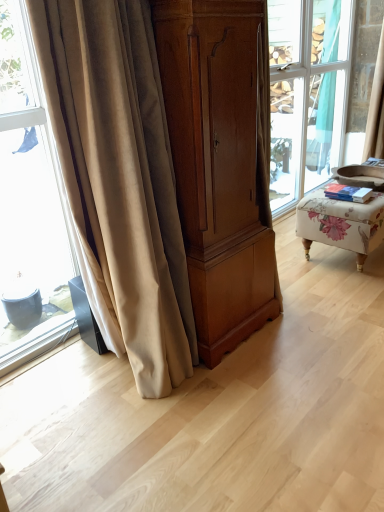
Question: Should I look upward or downward to see floral fabric ottoman at right?

Choices:
 (A) down
 (B) up

Answer: (B)

Question: Is matte wood cabinet at center not inside beige fabric curtain at upper right, the first curtain in the back-to-front sequence?

Choices:
 (A) no
 (B) yes

Answer: (B)

Question: Considering the relative sizes of matte wood cabinet at center and beige fabric curtain at upper right, positioned as the second curtain in left-to-right order, in the image provided, is matte wood cabinet at center bigger than beige fabric curtain at upper right, positioned as the second curtain in left-to-right order,?

Choices:
 (A) no
 (B) yes

Answer: (B)

Question: Is matte wood cabinet at center positioned before beige fabric curtain at upper right, the second curtain positioned from the front?

Choices:
 (A) no
 (B) yes

Answer: (B)

Question: From a real-world perspective, is matte wood cabinet at center located beneath beige fabric curtain at upper right, the first curtain when ordered from right to left?

Choices:
 (A) no
 (B) yes

Answer: (B)

Question: From the image's perspective, is matte wood cabinet at center under beige fabric curtain at upper right, the second curtain ordered from the bottom?

Choices:
 (A) yes
 (B) no

Answer: (A)

Question: Is matte wood cabinet at center oriented away from beige fabric curtain at upper right, the second curtain ordered from the bottom?

Choices:
 (A) no
 (B) yes

Answer: (A)

Question: From the image's perspective, would you say floral fabric ottoman at right is shown under beige velvet curtain at left, which is the 2th curtain in top-to-bottom order?

Choices:
 (A) yes
 (B) no

Answer: (B)

Question: Would you say floral fabric ottoman at right is outside beige velvet curtain at left, which ranks as the 1th curtain in bottom-to-top order?

Choices:
 (A) no
 (B) yes

Answer: (B)

Question: Can you confirm if floral fabric ottoman at right is positioned to the right of beige velvet curtain at left, which ranks as the 1th curtain in bottom-to-top order?

Choices:
 (A) no
 (B) yes

Answer: (B)

Question: Can you confirm if floral fabric ottoman at right is shorter than beige velvet curtain at left, which is the 2th curtain in top-to-bottom order?

Choices:
 (A) yes
 (B) no

Answer: (A)

Question: Can you confirm if floral fabric ottoman at right is wider than beige velvet curtain at left, which is the first curtain from left to right?

Choices:
 (A) yes
 (B) no

Answer: (A)

Question: Is floral fabric ottoman at right further to camera compared to beige velvet curtain at left, which is the 2th curtain in top-to-bottom order?

Choices:
 (A) no
 (B) yes

Answer: (B)

Question: Is matte wood cabinet at center behind beige velvet curtain at left, which is the first curtain from left to right?

Choices:
 (A) yes
 (B) no

Answer: (A)